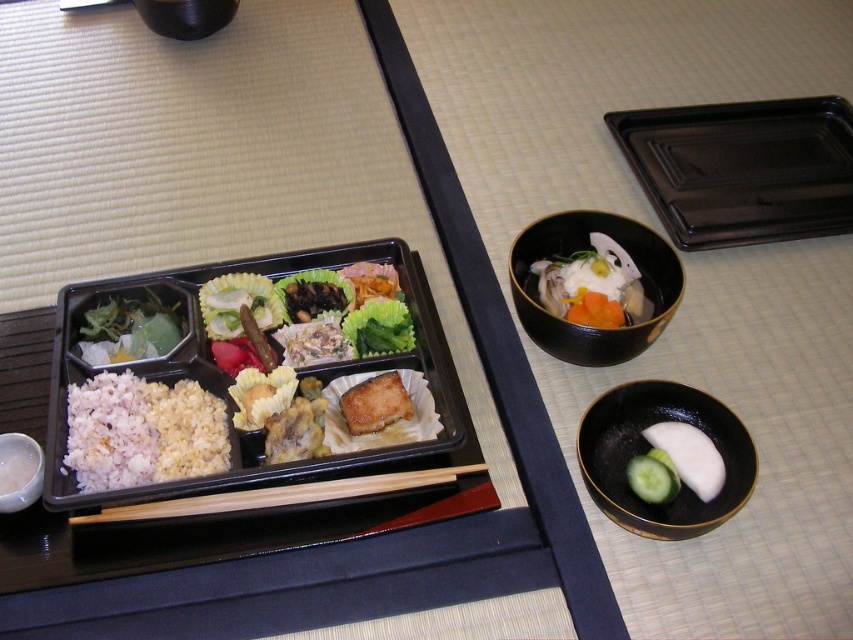
You are a photographer standing at a certain distance from the white matte rice at left. If you want to take a closeup shot of it without moving the camera, what should you do?

You should zoom in on the white matte rice at left since it is 35.57 inches away from the camera, which may require adjusting the zoom to capture a closeup without moving the camera position.

You are sitting on the tatami mat and want to pick up the white rice at center. Which direction should you reach to grab it from the white ceramic bowl at lower left?

The white rice at center is located above the white ceramic bowl at lower left, so you should reach upward from the white ceramic bowl at lower left to grab it.

In the scene shown: You are a guest at a traditional Japanese meal and see the white matte rice at left and the wooden chopsticks at center. Which object is higher in height?

The white matte rice at left is taller than the wooden chopsticks at center.